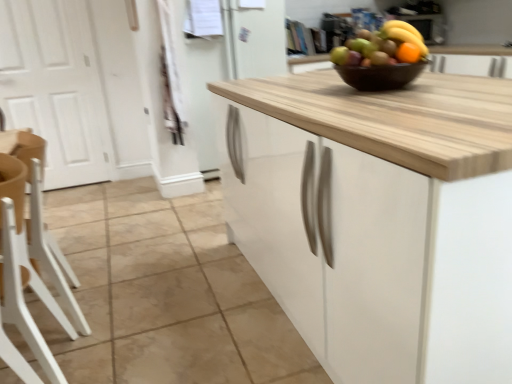
Identify the location of vacant space to the right of white wood chair at left, which is the 2th chair from front to back. Image resolution: width=512 pixels, height=384 pixels. (125, 311).